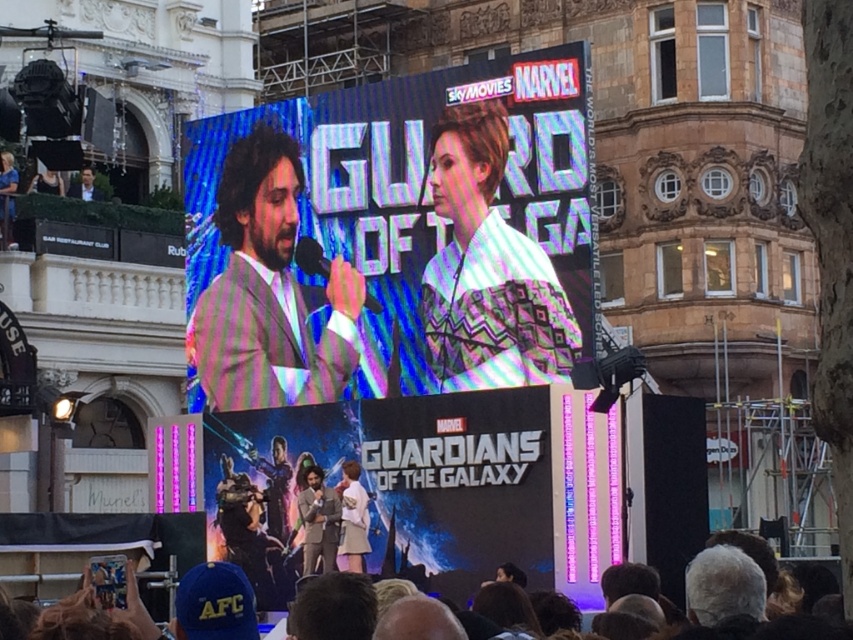
You are attending the Guardians of the Galaxy movie premiere and notice the matte digital screen at center and the satin striped suit at center. Which object is positioned higher in the image?

The matte digital screen at center is above the satin striped suit at center, so it is positioned higher.

You are a photographer at the event and need to capture a photo of both the matte black suit at center and the dark brown hair at lower center. Based on their positions, which object should you focus on first to ensure both are in frame?

The matte black suit at center is to the left of dark brown hair at lower center, so you should focus on the dark brown hair at lower center first to ensure both are in frame.